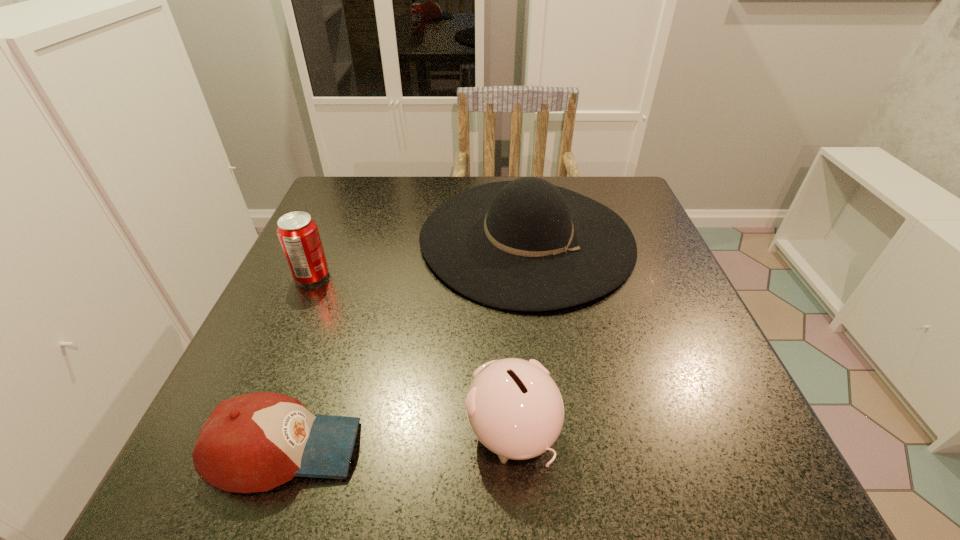
The height and width of the screenshot is (540, 960). I want to click on empty location between the sombrero and the piggy bank, so click(519, 335).

This screenshot has height=540, width=960. Find the location of `vacant space that's between the shortest object and the soda`. vacant space that's between the shortest object and the soda is located at coordinates (299, 362).

Select which object appears as the second closest to the piggy bank. Please provide its 2D coordinates. Your answer should be formatted as a tuple, i.e. [(x, y)], where the tuple contains the x and y coordinates of a point satisfying the conditions above.

[(527, 245)]

Where is `object that is the third closest to the baseball cap`? Image resolution: width=960 pixels, height=540 pixels. object that is the third closest to the baseball cap is located at coordinates (298, 234).

Find the location of a particular element. The height and width of the screenshot is (540, 960). vacant area that satisfies the following two spatial constraints: 1. on the front-facing side of the sombrero; 2. on the front-facing side of the shortest object is located at coordinates (555, 449).

You are a GUI agent. You are given a task and a screenshot of the screen. Output one action in this format:
    pyautogui.click(x=<x>, y=<y>)
    Task: Click on the vacant space that satisfies the following two spatial constraints: 1. on the front side of the piggy bank; 2. on the front-facing side of the shortest object
    This screenshot has width=960, height=540.
    Given the screenshot: What is the action you would take?
    pyautogui.click(x=513, y=449)